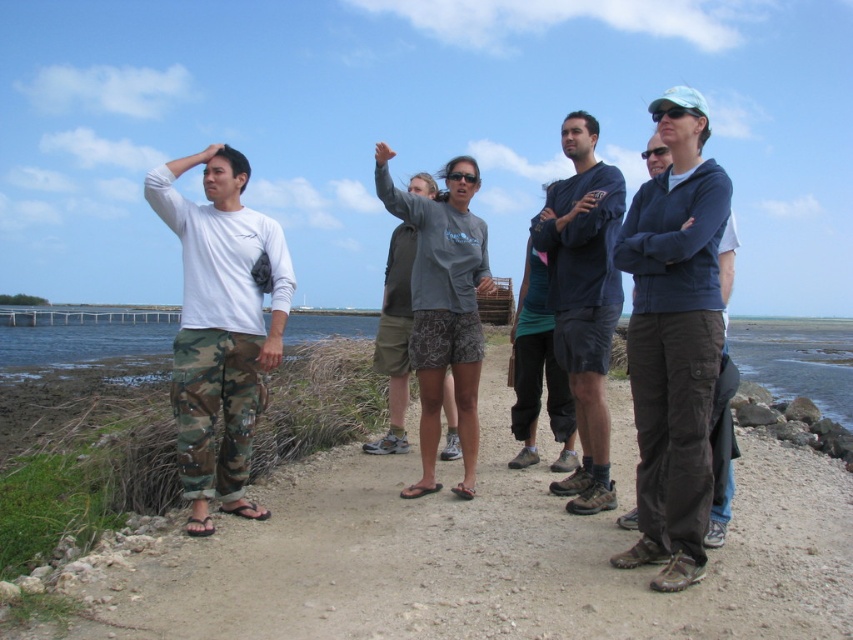
Question: Among these points, which one is farthest from the camera?

Choices:
 (A) (651, 160)
 (B) (250, 561)

Answer: (A)

Question: Estimate the real-world distances between objects in this image. Which object is closer to the dark blue fabric shirt at center?

Choices:
 (A) dark brown cargo pants at center
 (B) gray fabric shirt at center
 (C) camo pants at left
 (D) brown dirt path at center

Answer: (A)

Question: Which point is farther to the camera?

Choices:
 (A) dark brown cargo pants at center
 (B) dark blue fabric shirt at center
 (C) gray fabric shirt at center
 (D) camo pants at left

Answer: (C)

Question: Is brown dirt path at center smaller than dark blue fabric shirt at center?

Choices:
 (A) yes
 (B) no

Answer: (A)

Question: Is dark blue fabric shirt at center above gray fabric shirt at center?

Choices:
 (A) yes
 (B) no

Answer: (B)

Question: Does dark blue fabric shirt at center have a smaller size compared to gray fabric shirt at center?

Choices:
 (A) no
 (B) yes

Answer: (B)